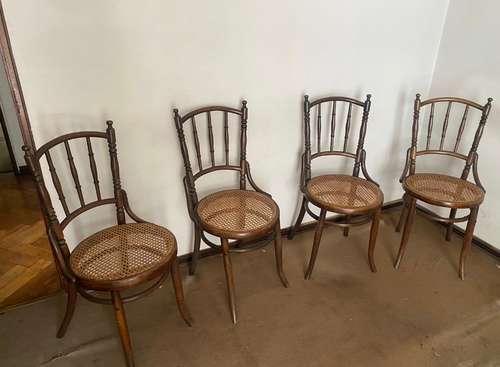
The image size is (500, 367). What are the coordinates of `elbow rests of chair` in the screenshot? It's located at (251, 180), (192, 202), (132, 213), (61, 259), (303, 171), (367, 172), (408, 168), (474, 178).